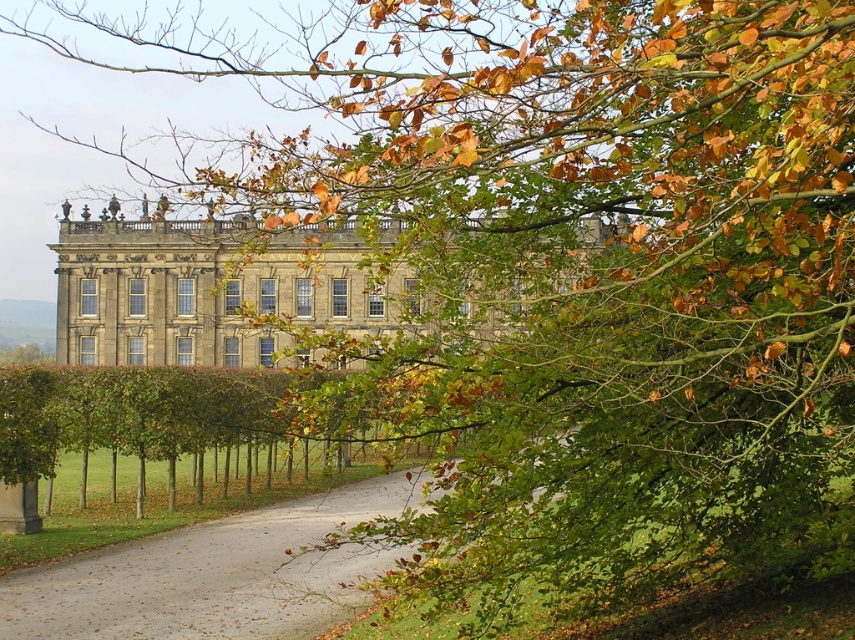
Question: Is the position of gray gravel driveway at center more distant than that of green leafy hedge at center?

Choices:
 (A) no
 (B) yes

Answer: (A)

Question: Is gray stone palace at center wider than green leafy hedge at center?

Choices:
 (A) yes
 (B) no

Answer: (A)

Question: Which point is farther to the camera?

Choices:
 (A) pyautogui.click(x=276, y=282)
 (B) pyautogui.click(x=322, y=376)

Answer: (A)

Question: Estimate the real-world distances between objects in this image. Which object is farther from the gray stone palace at center?

Choices:
 (A) green leafy hedge at center
 (B) gray gravel driveway at center

Answer: (B)

Question: Is gray stone palace at center above green leafy hedge at center?

Choices:
 (A) no
 (B) yes

Answer: (B)

Question: Which of these objects is positioned closest to the gray gravel driveway at center?

Choices:
 (A) gray stone palace at center
 (B) green leafy hedge at center

Answer: (B)